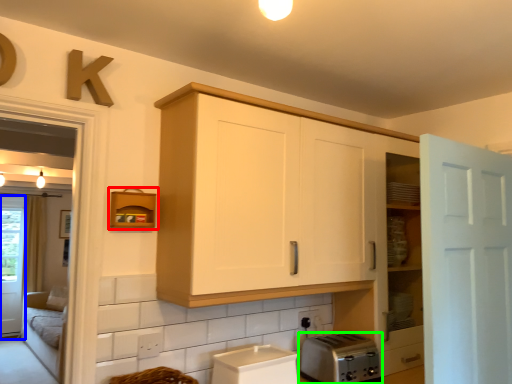
Question: Which object is positioned farthest from shelf (highlighted by a red box)? Select from screen door (highlighted by a blue box) and toaster (highlighted by a green box).

Choices:
 (A) screen door
 (B) toaster

Answer: (A)